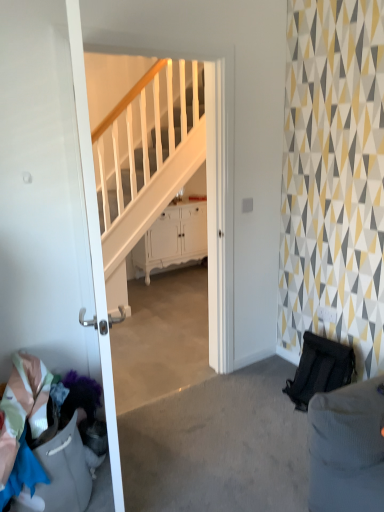
Image resolution: width=384 pixels, height=512 pixels. Find the location of `vacant region to the right of white glossy door at left`. vacant region to the right of white glossy door at left is located at coordinates (192, 466).